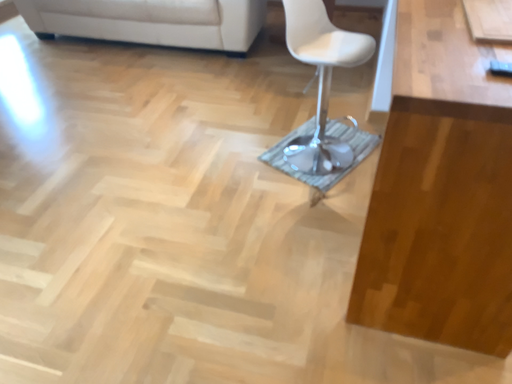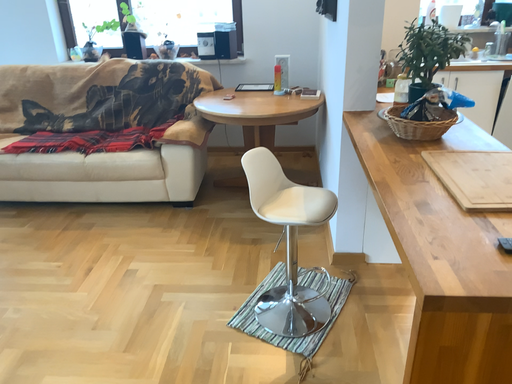
Question: Which way did the camera rotate in the video?

Choices:
 (A) rotated downward
 (B) rotated upward

Answer: (B)